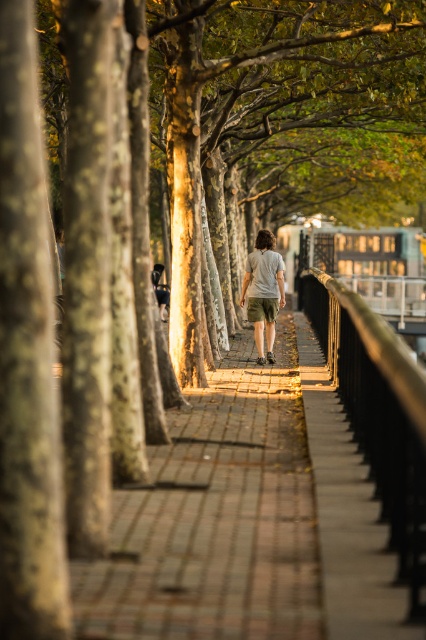
You are a hiker walking along the pathway and notice the metallic rail at right and the khaki shorts at center. Which object is taller?

The metallic rail at right is taller than the khaki shorts at center.

You are standing on the pathway in the scene and want to walk towards the bridge in the distance. There are two points marked on the path, one at coordinates point (354,307) and another at point (249,317). Which point should you head towards if you want to reach the bridge faster?

Point (249,317) is further away from the viewer than point (354,307). Since the bridge is in the distance, you should head towards the point that is further away to reach the bridge faster, so choose point (249,317).